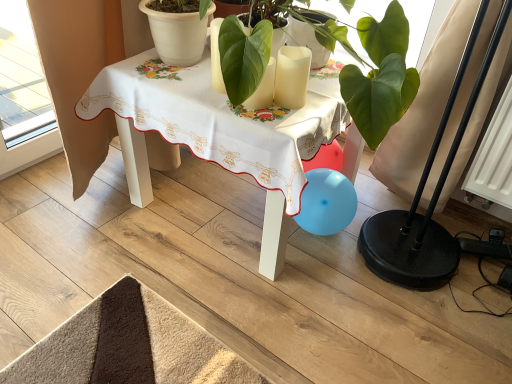
You are a GUI agent. You are given a task and a screenshot of the screen. Output one action in this format:
    pyautogui.click(x=<x>, y=<y>)
    Task: Click on the free space to the left of white fabric table at center
    The image size is (512, 384).
    Given the screenshot: What is the action you would take?
    pyautogui.click(x=67, y=222)